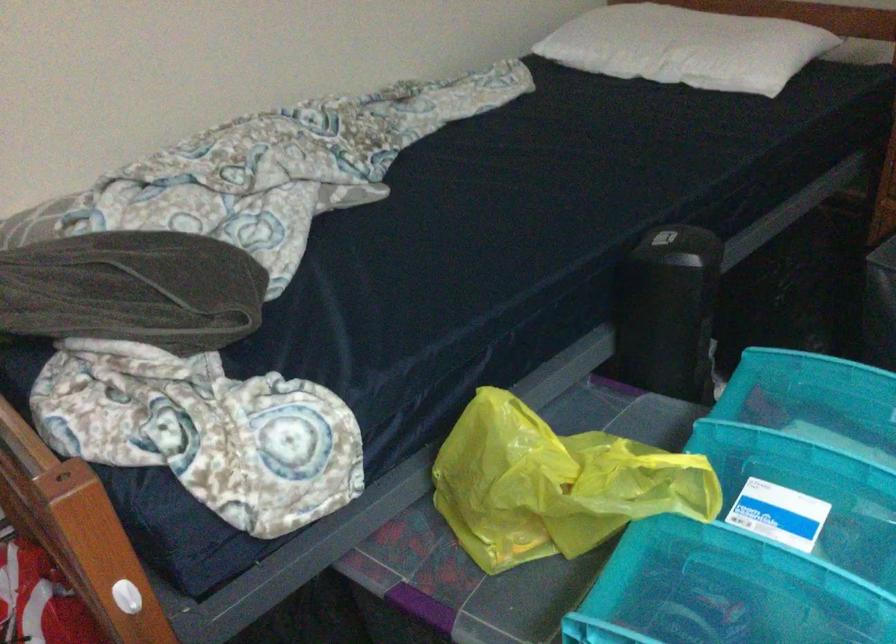
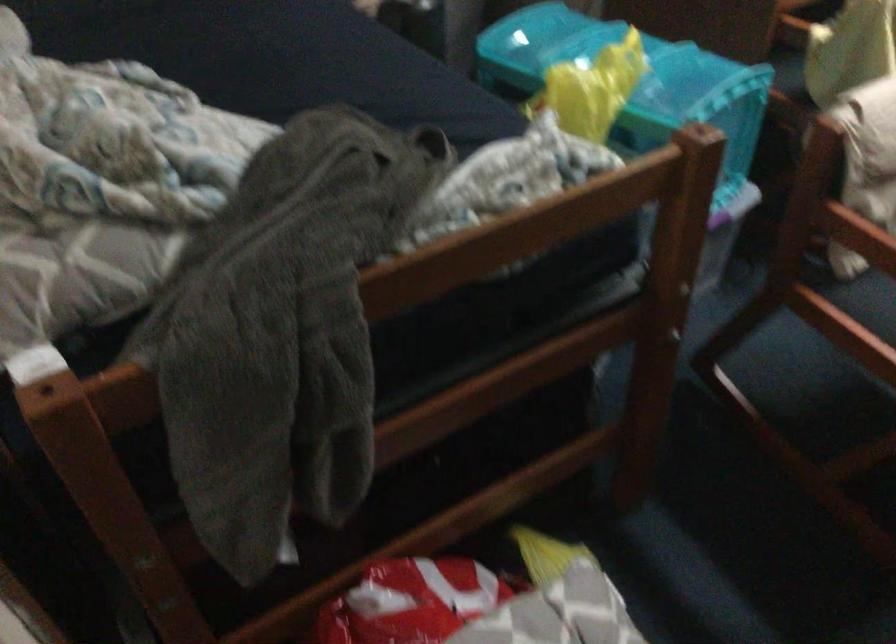
Where in the second image is the point corresponding to (x=627, y=455) from the first image?

(600, 62)